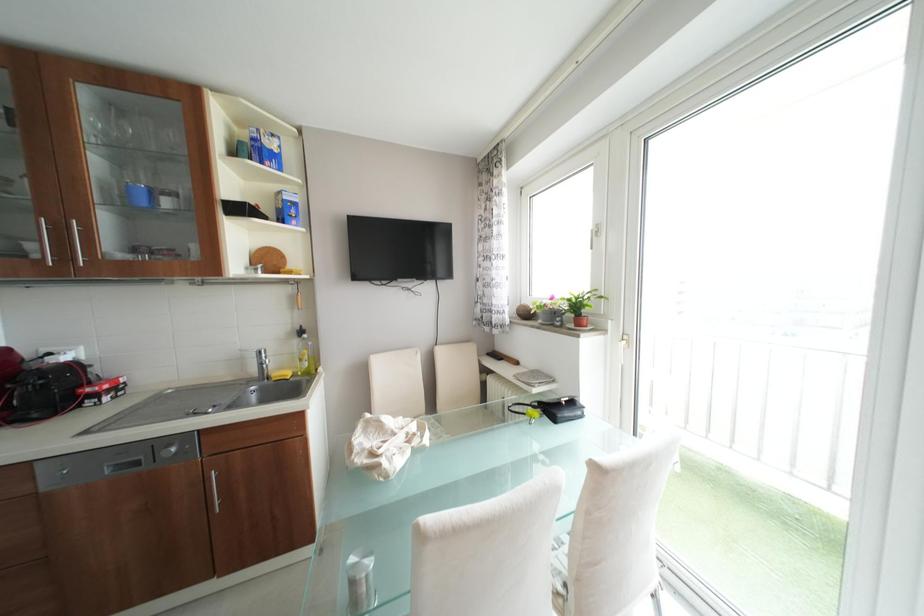
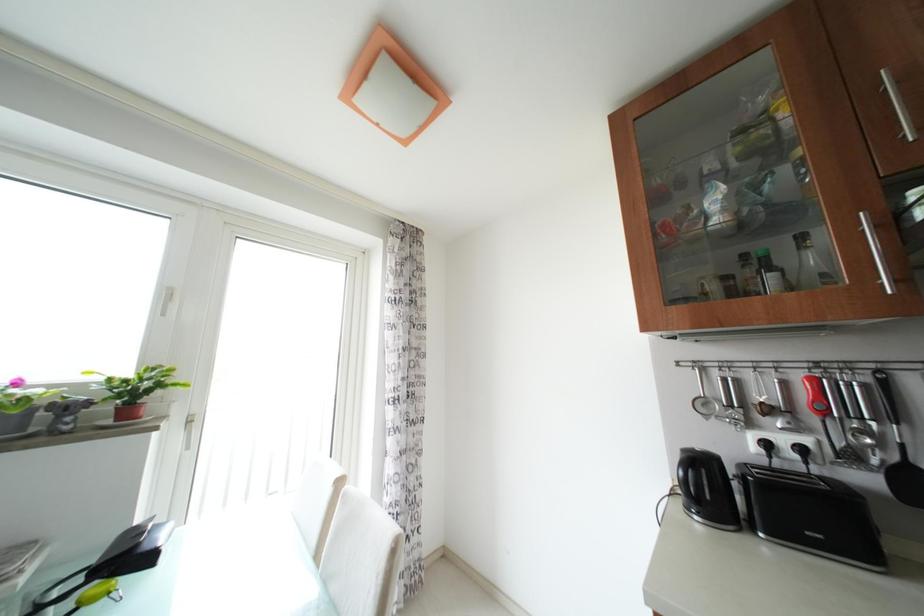
Question: The images are taken continuously from a first-person perspective. In which direction is your viewpoint rotating?

Choices:
 (A) Left
 (B) Right
 (C) Up
 (D) Down

Answer: (B)